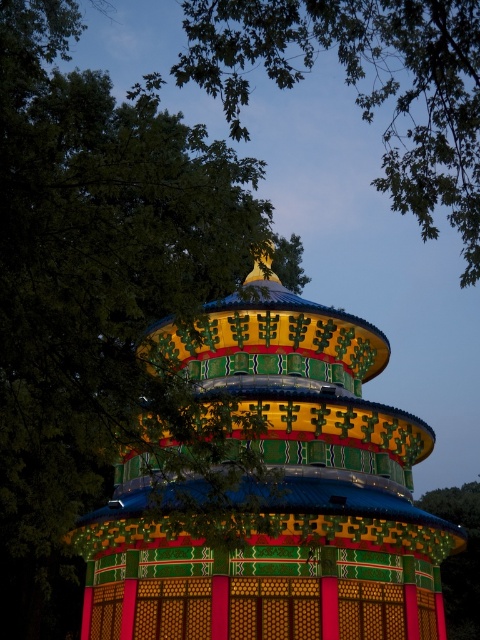
Who is shorter, green leafy tree at upper center or green textured tree at center?

Standing shorter between the two is green textured tree at center.

Locate an element on the screen. The image size is (480, 640). green leafy tree at upper center is located at coordinates (365, 84).

You are a GUI agent. You are given a task and a screenshot of the screen. Output one action in this format:
    pyautogui.click(x=<x>, y=<y>)
    Task: Click on the green leafy tree at upper center
    The height and width of the screenshot is (640, 480).
    Given the screenshot: What is the action you would take?
    pyautogui.click(x=365, y=84)

Describe the element at coordinates (279, 493) in the screenshot. I see `multicolored painted pagoda at center` at that location.

Does multicolored painted pagoda at center have a smaller size compared to green textured tree at center?

Actually, multicolored painted pagoda at center might be larger than green textured tree at center.

Find the location of a particular element. multicolored painted pagoda at center is located at coordinates (279, 493).

Does point (26, 461) lie in front of point (446, 625)?

That is True.

Find the location of `green leafy tree at upper left`. green leafy tree at upper left is located at coordinates click(95, 289).